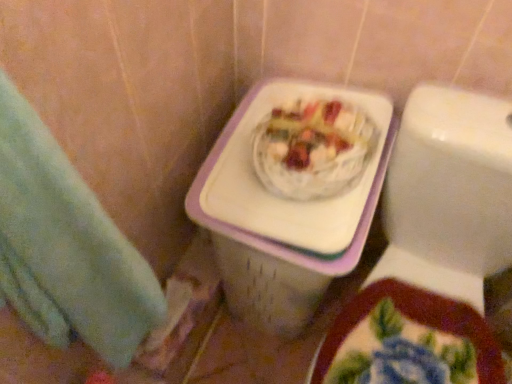
Question: Would you say white glossy toilet at upper right is to the left or to the right of white plastic basket at center in the picture?

Choices:
 (A) left
 (B) right

Answer: (B)

Question: From the image's perspective, is white glossy toilet at upper right positioned above or below white plastic basket at center?

Choices:
 (A) above
 (B) below

Answer: (B)

Question: Which of these objects is positioned closest to the white plastic basket at center?

Choices:
 (A) white glossy toilet at upper right
 (B) green towel at left

Answer: (A)

Question: Which is farther from the green towel at left?

Choices:
 (A) white plastic basket at center
 (B) white glossy toilet at upper right

Answer: (B)